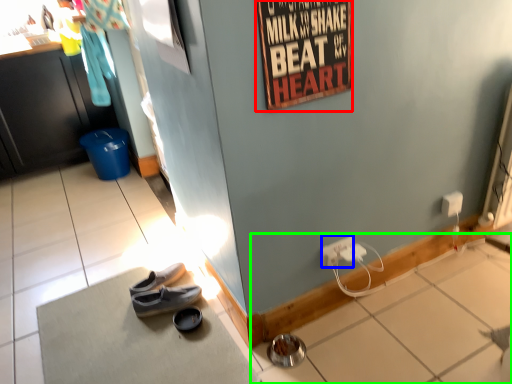
Question: Estimate the real-world distances between objects in this image. Which object is farther from poster page (highlighted by a red box), power outlet (highlighted by a blue box) or tile (highlighted by a green box)?

Choices:
 (A) power outlet
 (B) tile

Answer: (B)